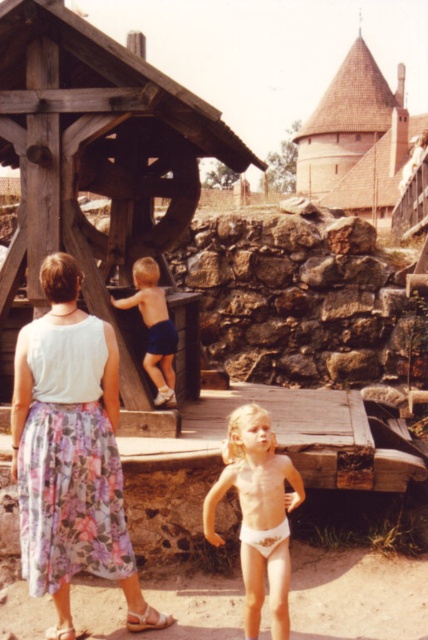
Can you confirm if wooden gazebo at center is thinner than floral skirt at center?

Yes.

Does point (163, 113) come behind point (107, 406)?

Yes, point (163, 113) is behind point (107, 406).

The width and height of the screenshot is (428, 640). In order to click on wooden gazebo at center in this screenshot , I will do `click(97, 154)`.

Is wooden gazebo at center wider than tan skin child at center?

Correct, the width of wooden gazebo at center exceeds that of tan skin child at center.

Locate an element on the screen. The height and width of the screenshot is (640, 428). wooden gazebo at center is located at coordinates (97, 154).

From the picture: Can you confirm if floral skirt at center is positioned to the left of blue denim shorts at center?

Correct, you'll find floral skirt at center to the left of blue denim shorts at center.

Is floral skirt at center wider than blue denim shorts at center?

Correct, the width of floral skirt at center exceeds that of blue denim shorts at center.

Describe the element at coordinates (71, 452) in the screenshot. I see `floral skirt at center` at that location.

Locate an element on the screen. The image size is (428, 640). floral skirt at center is located at coordinates (71, 452).